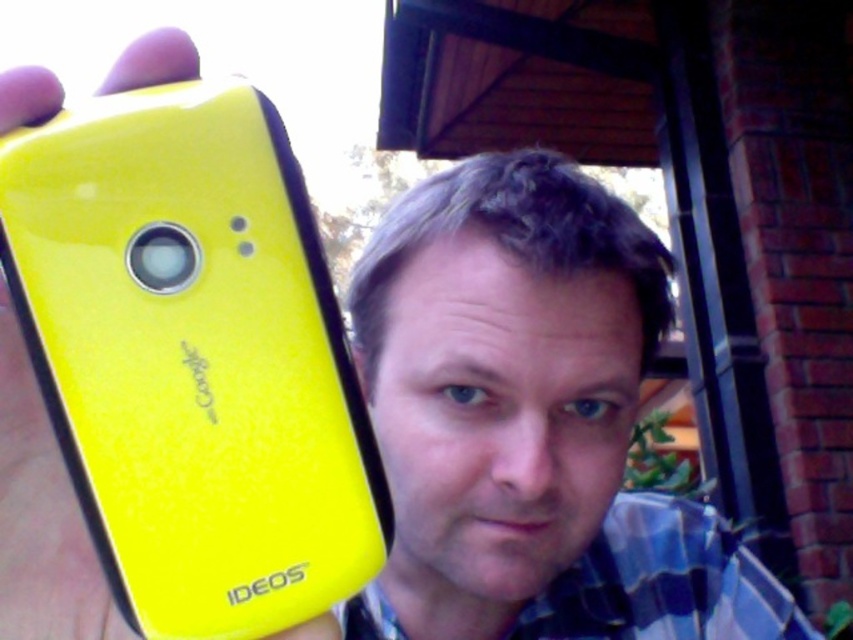
Is the position of yellow matte phone at left more distant than that of matte yellow phone at upper left?

That is False.

Is yellow matte phone at left thinner than matte yellow phone at upper left?

Yes, yellow matte phone at left is thinner than matte yellow phone at upper left.

Where is `yellow matte phone at left`? The height and width of the screenshot is (640, 853). yellow matte phone at left is located at coordinates (41, 516).